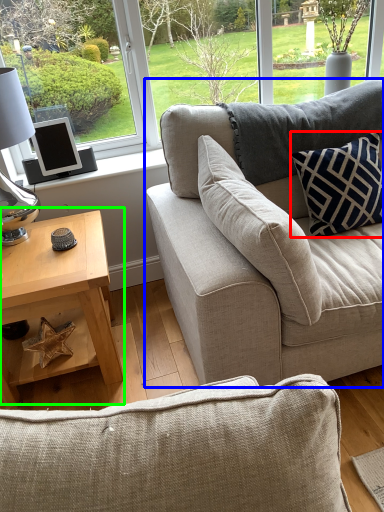
Question: Estimate the real-world distances between objects in this image. Which object is closer to pillow (highlighted by a red box), studio couch (highlighted by a blue box) or coffee table (highlighted by a green box)?

Choices:
 (A) studio couch
 (B) coffee table

Answer: (A)